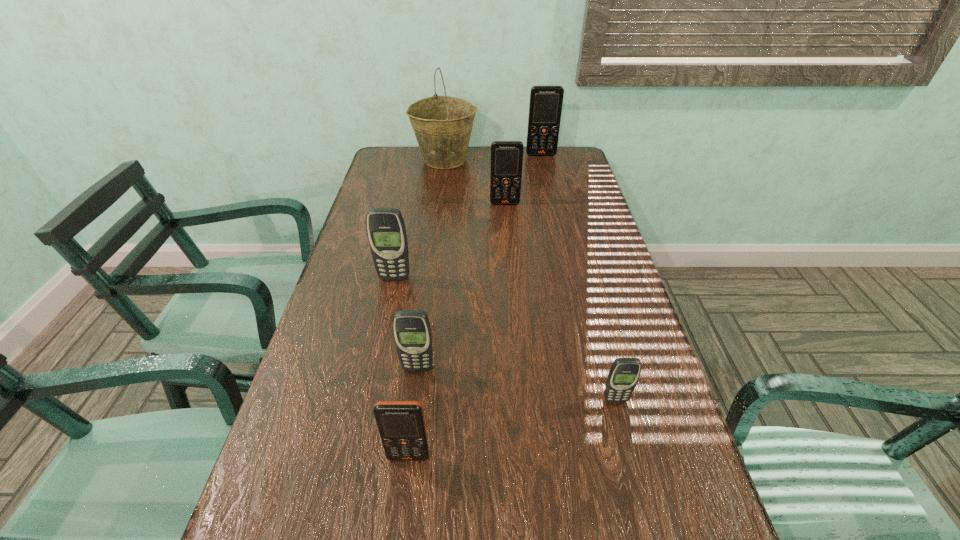
At what (x,y) coordinates should I click in order to perform the action: click on object identified as the sixth closest to the wine bucket. Please return your answer as a coordinate pair (x, y). The height and width of the screenshot is (540, 960). Looking at the image, I should click on (401, 424).

Find the location of `cellular telephone that is the sixth closest one to the wine bucket`. cellular telephone that is the sixth closest one to the wine bucket is located at coordinates (401, 424).

Where is `cellular telephone that is the third nearest to the tallest object`? This screenshot has height=540, width=960. cellular telephone that is the third nearest to the tallest object is located at coordinates (386, 232).

I want to click on orange cellular telephone that is the third nearest to the tallest object, so click(401, 424).

Locate which orange cellular telephone is the second closest to the biggest orange cellular telephone. Please provide its 2D coordinates. Your answer should be formatted as a tuple, i.e. [(x, y)], where the tuple contains the x and y coordinates of a point satisfying the conditions above.

[(401, 424)]

Identify the location of the second closest gray cellular telephone to the nearest gray cellular telephone. This screenshot has width=960, height=540. (386, 232).

I want to click on gray cellular telephone that is the second closest to the rightmost orange cellular telephone, so click(412, 333).